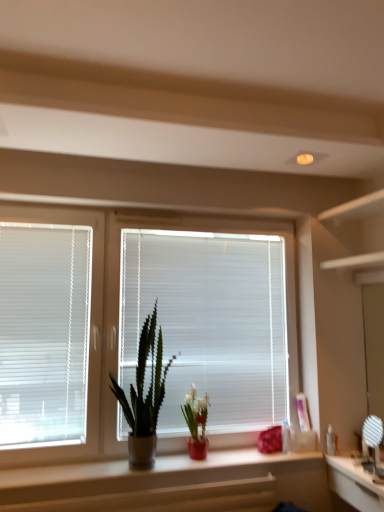
I want to click on free space above smooth white counter at lower center (from a real-world perspective), so click(148, 466).